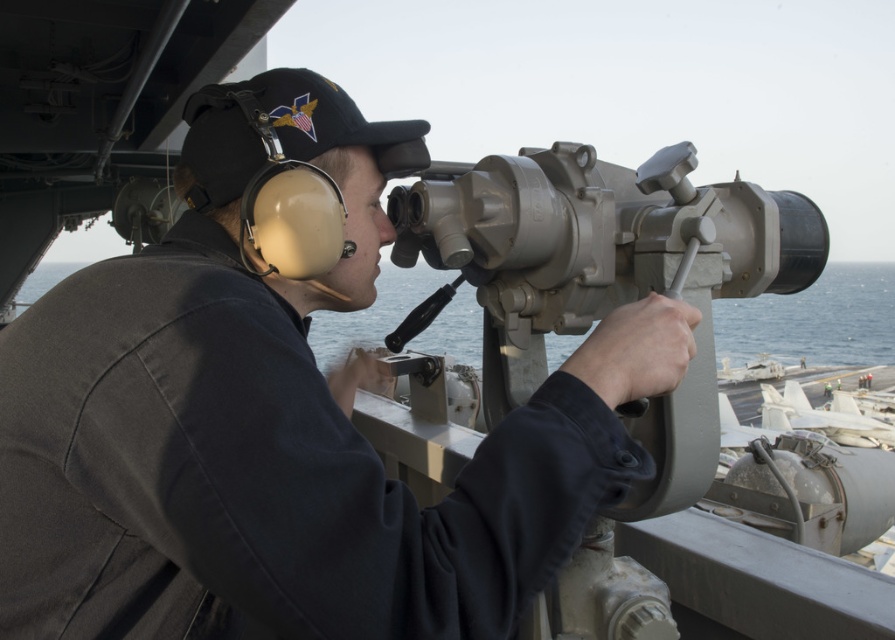
Question: In this image, where is matte black uniform at center located relative to matte gray telescope at center?

Choices:
 (A) below
 (B) above

Answer: (B)

Question: Which object appears farthest from the camera in this image?

Choices:
 (A) matte black uniform at center
 (B) matte gray telescope at center

Answer: (B)

Question: Which of the following is the farthest from the observer?

Choices:
 (A) matte black uniform at center
 (B) matte gray telescope at center

Answer: (B)

Question: Is matte black uniform at center positioned in front of matte gray telescope at center?

Choices:
 (A) no
 (B) yes

Answer: (B)

Question: Is matte black uniform at center thinner than matte gray telescope at center?

Choices:
 (A) yes
 (B) no

Answer: (A)